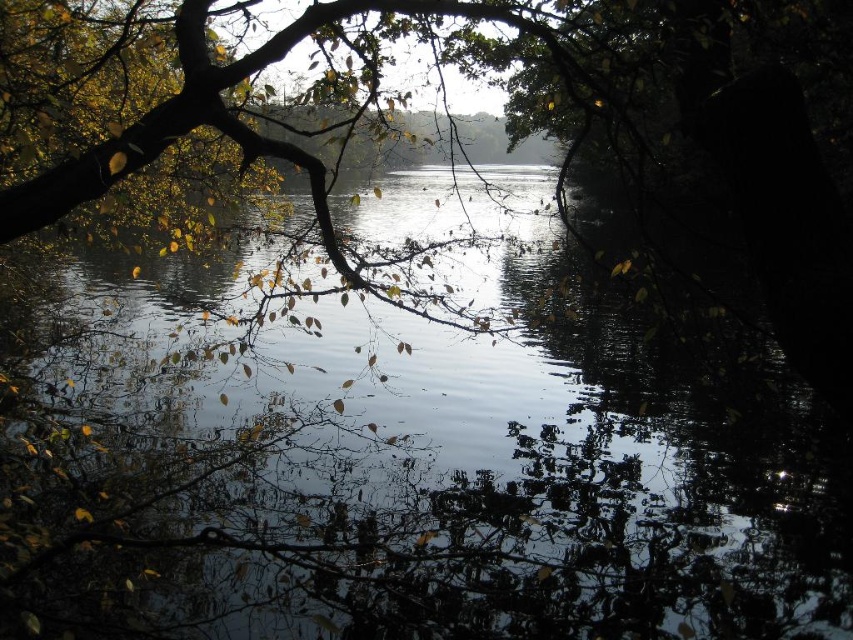
From the picture: You are an artist sketching the scene from under the tree. You want to ensure the transparent water at center and green matte leaves at upper left are proportionally accurate. Which object should you draw first to maintain the correct size relationship?

You should draw the transparent water at center first because it is larger than the green matte leaves at upper left, ensuring the size relationship is maintained.